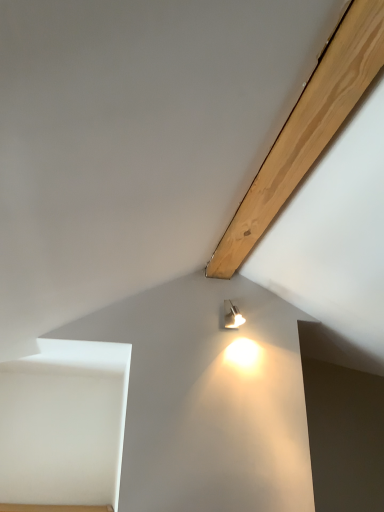
This screenshot has width=384, height=512. Describe the element at coordinates (307, 128) in the screenshot. I see `natural wood beam at upper right` at that location.

What is the approximate height of natural wood beam at upper right?

2.19 inches.

Identify the location of natural wood beam at upper right. The image size is (384, 512). (307, 128).

Where is `matte silver lamp at upper right`? The image size is (384, 512). matte silver lamp at upper right is located at coordinates (232, 315).

Describe the element at coordinates (232, 315) in the screenshot. This screenshot has height=512, width=384. I see `matte silver lamp at upper right` at that location.

Find the location of `natural wood beam at upper right`. natural wood beam at upper right is located at coordinates point(307,128).

Between matte silver lamp at upper right and natural wood beam at upper right, which one appears on the left side from the viewer's perspective?

matte silver lamp at upper right is more to the left.

Considering the relative positions of matte silver lamp at upper right and natural wood beam at upper right in the image provided, is matte silver lamp at upper right behind natural wood beam at upper right?

Yes, matte silver lamp at upper right is behind natural wood beam at upper right.

Which point is more forward, (228, 304) or (364, 81)?

The point (364, 81) is in front.

From the image's perspective, between matte silver lamp at upper right and natural wood beam at upper right, who is located below?

matte silver lamp at upper right.

From a real-world perspective, who is located lower, matte silver lamp at upper right or natural wood beam at upper right?

matte silver lamp at upper right.

Does matte silver lamp at upper right have a greater width compared to natural wood beam at upper right?

Yes, matte silver lamp at upper right is wider than natural wood beam at upper right.

Which of these two, matte silver lamp at upper right or natural wood beam at upper right, stands shorter?

With less height is natural wood beam at upper right.

Does matte silver lamp at upper right have a larger size compared to natural wood beam at upper right?

No, matte silver lamp at upper right is not bigger than natural wood beam at upper right.

Is matte silver lamp at upper right not within natural wood beam at upper right?

Yes, matte silver lamp at upper right is outside of natural wood beam at upper right.

Would you consider matte silver lamp at upper right to be distant from natural wood beam at upper right?

They are positioned close to each other.

Is matte silver lamp at upper right looking in the opposite direction of natural wood beam at upper right?

No, matte silver lamp at upper right is not facing the opposite direction of natural wood beam at upper right.

Locate an element on the screen. The width and height of the screenshot is (384, 512). plywood that appears on the right of matte silver lamp at upper right is located at coordinates (307, 128).

Would you say natural wood beam at upper right is to the left or to the right of matte silver lamp at upper right in the picture?

natural wood beam at upper right is to the right of matte silver lamp at upper right.

Considering the positions of objects natural wood beam at upper right and matte silver lamp at upper right in the image provided, who is behind, natural wood beam at upper right or matte silver lamp at upper right?

matte silver lamp at upper right is further from the camera.

Between point (335, 112) and point (225, 325), which one is positioned behind?

Positioned behind is point (225, 325).

From the image's perspective, who appears lower, natural wood beam at upper right or matte silver lamp at upper right?

matte silver lamp at upper right appears lower in the image.

From a real-world perspective, who is located lower, natural wood beam at upper right or matte silver lamp at upper right?

From a 3D spatial view, matte silver lamp at upper right is below.

From the picture: In terms of width, does natural wood beam at upper right look wider or thinner when compared to matte silver lamp at upper right?

Clearly, natural wood beam at upper right has less width compared to matte silver lamp at upper right.

In terms of height, does natural wood beam at upper right look taller or shorter compared to matte silver lamp at upper right?

Clearly, natural wood beam at upper right is shorter compared to matte silver lamp at upper right.

Looking at the image, does natural wood beam at upper right seem bigger or smaller compared to matte silver lamp at upper right?

Considering their sizes, natural wood beam at upper right takes up more space than matte silver lamp at upper right.

Can matte silver lamp at upper right be found inside natural wood beam at upper right?

No, matte silver lamp at upper right is not surrounded by natural wood beam at upper right.

Are natural wood beam at upper right and matte silver lamp at upper right far apart?

No, natural wood beam at upper right is not far away from matte silver lamp at upper right.

Is natural wood beam at upper right positioned with its back to matte silver lamp at upper right?

No, matte silver lamp at upper right is not at the back of natural wood beam at upper right.

Measure the distance from natural wood beam at upper right to matte silver lamp at upper right.

natural wood beam at upper right is 32.64 inches from matte silver lamp at upper right.

The height and width of the screenshot is (512, 384). I want to click on lamp below the natural wood beam at upper right (from the image's perspective), so [x=232, y=315].

This screenshot has width=384, height=512. Find the location of `plywood above the matte silver lamp at upper right (from a real-world perspective)`. plywood above the matte silver lamp at upper right (from a real-world perspective) is located at coordinates (307, 128).

You are a GUI agent. You are given a task and a screenshot of the screen. Output one action in this format:
    pyautogui.click(x=<x>, y=<y>)
    Task: Click on the lamp that is on the left side of natural wood beam at upper right
    
    Given the screenshot: What is the action you would take?
    pyautogui.click(x=232, y=315)